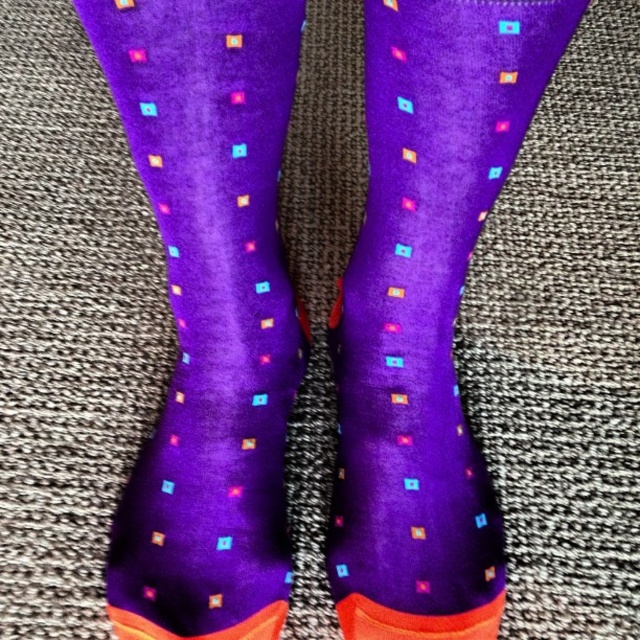
Can you confirm if purple velvet socks at center is smaller than purple matte socks at center?

No, purple velvet socks at center is not smaller than purple matte socks at center.

Who is positioned more to the left, purple velvet socks at center or purple matte socks at center?

From the viewer's perspective, purple velvet socks at center appears more on the left side.

Does point (246, 108) come behind point (480, 17)?

Yes.

This screenshot has height=640, width=640. Find the location of `purple velvet socks at center`. purple velvet socks at center is located at coordinates (209, 312).